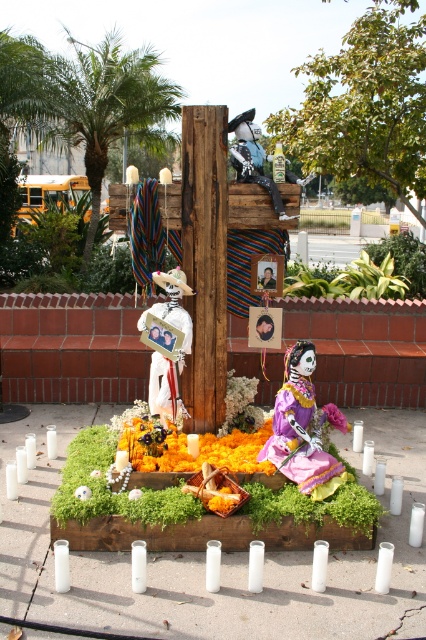
Is point (239, 458) closer to camera compared to point (264, 276)?

Yes.

Between point (212, 461) and point (259, 280), which one is positioned behind?

Point (259, 280)

You are a GUI agent. You are given a task and a screenshot of the screen. Output one action in this format:
    pyautogui.click(x=<x>, y=<y>)
    Task: Click on the marigold petals at center
    The width and height of the screenshot is (426, 640).
    Given the screenshot: What is the action you would take?
    pyautogui.click(x=212, y=452)

Is point (163, 385) positioned in front of point (328, 404)?

That is False.

Does white paper photo frame at center have a lesser height compared to pink fabric flower at center?

No, white paper photo frame at center is not shorter than pink fabric flower at center.

Between point (181, 326) and point (340, 422), which one is positioned behind?

The point (340, 422) is behind.

Where is `white paper photo frame at center`? white paper photo frame at center is located at coordinates (172, 308).

Who is more distant from viewer, (273, 328) or (163, 339)?

The point (273, 328) is behind.

Which of these two, matte plastic photo frame at center or white paper skull at center, stands taller?

matte plastic photo frame at center

Who is more distant from viewer, (265, 316) or (161, 340)?

The point (265, 316) is more distant.

The height and width of the screenshot is (640, 426). In order to click on matte plastic photo frame at center in this screenshot , I will do `click(264, 326)`.